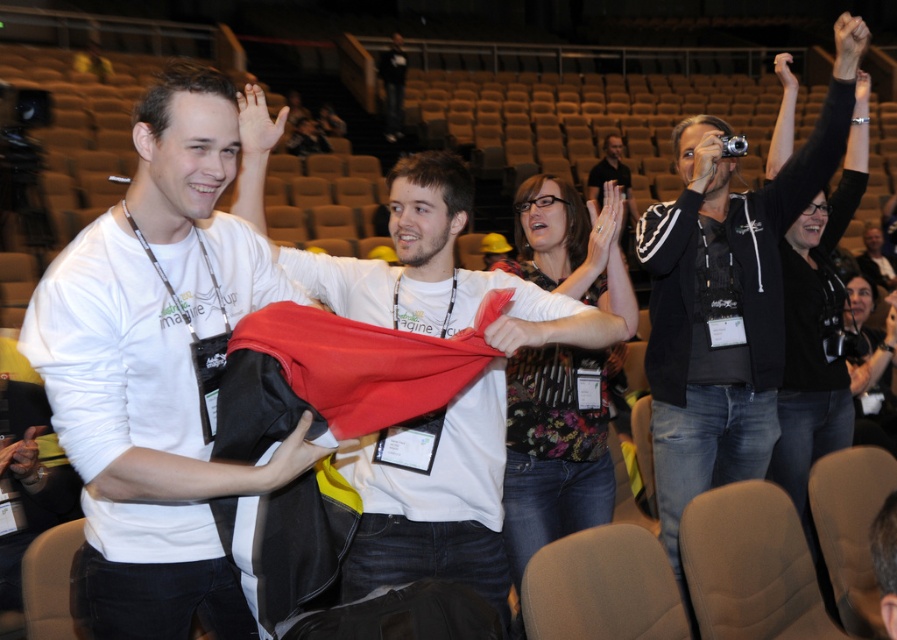
Measure the distance from white matte t-shirt at center to black hoodie at upper right.

A distance of 1.19 meters exists between white matte t-shirt at center and black hoodie at upper right.

Does white matte t-shirt at center appear over black hoodie at upper right?

Actually, white matte t-shirt at center is below black hoodie at upper right.

Who is more distant from viewer, (450, 508) or (739, 252)?

Point (739, 252)

Find the location of a particular element. white matte t-shirt at center is located at coordinates (434, 497).

Which is more to the right, black hoodie at upper right or matte black jacket at center?

matte black jacket at center

Does black hoodie at upper right lie behind matte black jacket at center?

No, black hoodie at upper right is in front of matte black jacket at center.

At what (x,y) coordinates should I click in order to perform the action: click on black hoodie at upper right. Please return your answer as a coordinate pair (x, y). This screenshot has width=897, height=640. Looking at the image, I should click on (726, 300).

Can you confirm if white matte t-shirt at left is positioned above black hoodie at upper right?

Actually, white matte t-shirt at left is below black hoodie at upper right.

Does white matte t-shirt at left have a lesser width compared to black hoodie at upper right?

Yes.

The image size is (897, 640). Describe the element at coordinates (157, 371) in the screenshot. I see `white matte t-shirt at left` at that location.

Identify the location of white matte t-shirt at left. This screenshot has height=640, width=897. (157, 371).